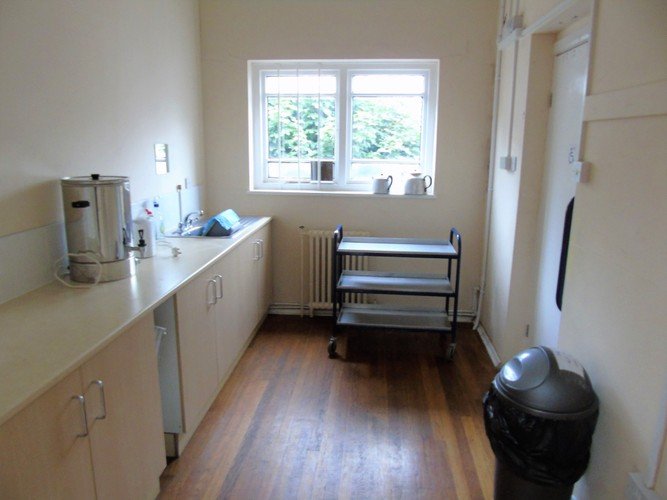
Locate an element on the screen. The height and width of the screenshot is (500, 667). garbage can is located at coordinates (557, 393), (522, 490).